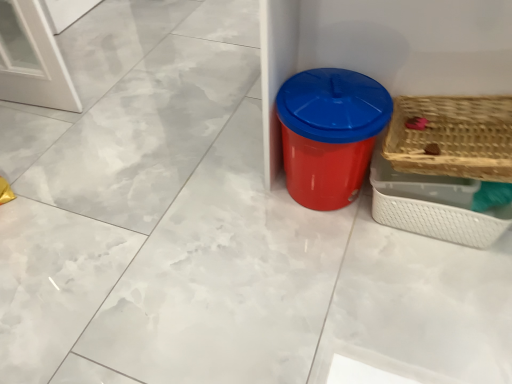
Question: Does red plastic bin at center appear on the left side of woven wood basket at right, placed as the second basket when sorted from top to bottom?

Choices:
 (A) no
 (B) yes

Answer: (B)

Question: From the image's perspective, is red plastic bin at center under woven wood basket at right, placed as the second basket when sorted from top to bottom?

Choices:
 (A) yes
 (B) no

Answer: (B)

Question: Is red plastic bin at center wider than woven wood basket at right, which appears as the 1th basket when ordered from the bottom?

Choices:
 (A) yes
 (B) no

Answer: (A)

Question: From a real-world perspective, is red plastic bin at center physically above woven wood basket at right, placed as the second basket when sorted from top to bottom?

Choices:
 (A) yes
 (B) no

Answer: (A)

Question: Is woven wood basket at right, placed as the second basket when sorted from top to bottom, at the back of red plastic bin at center?

Choices:
 (A) yes
 (B) no

Answer: (B)

Question: Is red plastic bin at center inside or outside of woven wood basket at right, the 2th basket in the bottom-to-top sequence?

Choices:
 (A) inside
 (B) outside

Answer: (B)

Question: In the image, is red plastic bin at center on the left side or the right side of woven wood basket at right, the 2th basket in the bottom-to-top sequence?

Choices:
 (A) right
 (B) left

Answer: (B)

Question: Is red plastic bin at center bigger or smaller than woven wood basket at right, the 1th basket from the top?

Choices:
 (A) big
 (B) small

Answer: (A)

Question: Looking at their shapes, would you say red plastic bin at center is wider or thinner than woven wood basket at right, the 1th basket from the top?

Choices:
 (A) wide
 (B) thin

Answer: (A)

Question: Considering the relative positions of woven wood basket at right, which appears as the 1th basket when ordered from the bottom, and red plastic bin at center in the image provided, is woven wood basket at right, which appears as the 1th basket when ordered from the bottom, to the left or to the right of red plastic bin at center?

Choices:
 (A) right
 (B) left

Answer: (A)

Question: Considering the positions of woven wood basket at right, which appears as the 1th basket when ordered from the bottom, and red plastic bin at center in the image, is woven wood basket at right, which appears as the 1th basket when ordered from the bottom, bigger or smaller than red plastic bin at center?

Choices:
 (A) big
 (B) small

Answer: (B)

Question: In terms of width, does woven wood basket at right, placed as the second basket when sorted from top to bottom, look wider or thinner when compared to red plastic bin at center?

Choices:
 (A) wide
 (B) thin

Answer: (B)

Question: From the image's perspective, is woven wood basket at right, which appears as the 1th basket when ordered from the bottom, positioned above or below red plastic bin at center?

Choices:
 (A) below
 (B) above

Answer: (A)

Question: Considering the positions of point (476, 213) and point (389, 137), is point (476, 213) closer or farther from the camera than point (389, 137)?

Choices:
 (A) farther
 (B) closer

Answer: (A)

Question: From the image's perspective, is woven wood basket at right, placed as the second basket when sorted from top to bottom, located above or below woven wood basket at right, the 1th basket from the top?

Choices:
 (A) above
 (B) below

Answer: (B)